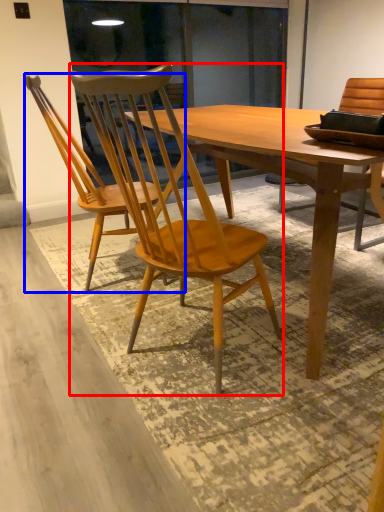
Question: Which object appears farthest to the camera in this image, chair (highlighted by a red box) or chair (highlighted by a blue box)?

Choices:
 (A) chair
 (B) chair

Answer: (B)